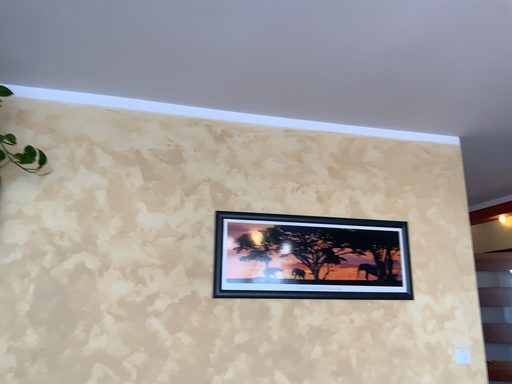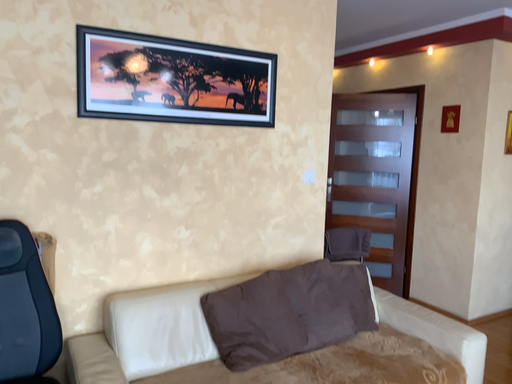
Question: Which way did the camera rotate in the video?

Choices:
 (A) rotated downward
 (B) rotated upward

Answer: (A)